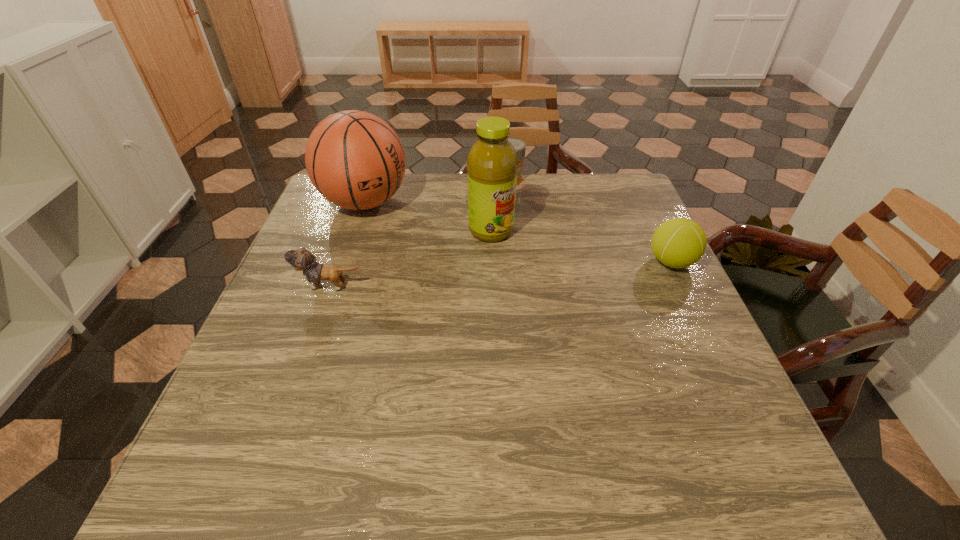
Where is `vacant space situated on the surface of the basketball near the brand logo`? This screenshot has width=960, height=540. vacant space situated on the surface of the basketball near the brand logo is located at coordinates (431, 240).

Where is `vacant space located 0.300m on the surface of the basketball near the brand logo`? This screenshot has height=540, width=960. vacant space located 0.300m on the surface of the basketball near the brand logo is located at coordinates (476, 266).

Where is `vacant space located 0.240m on the label side of the medicine`? The height and width of the screenshot is (540, 960). vacant space located 0.240m on the label side of the medicine is located at coordinates (520, 234).

I want to click on free point located on the label side of the medicine, so click(x=519, y=228).

Image resolution: width=960 pixels, height=540 pixels. What are the coordinates of `vacant space located on the label side of the medicine` in the screenshot? It's located at click(x=516, y=205).

At what (x,y) coordinates should I click in order to perform the action: click on fruit juice that is at the far edge. Please return your answer as a coordinate pair (x, y). This screenshot has width=960, height=540. Looking at the image, I should click on (492, 163).

Find the location of a particular element. This screenshot has width=960, height=540. basketball positioned at the far edge is located at coordinates (354, 159).

Find the location of `medicine present at the far edge`. medicine present at the far edge is located at coordinates (520, 146).

Where is `kitten located at the left edge`? The width and height of the screenshot is (960, 540). kitten located at the left edge is located at coordinates (301, 259).

The image size is (960, 540). Find the location of `basketball located in the left edge section of the desktop`. basketball located in the left edge section of the desktop is located at coordinates (354, 159).